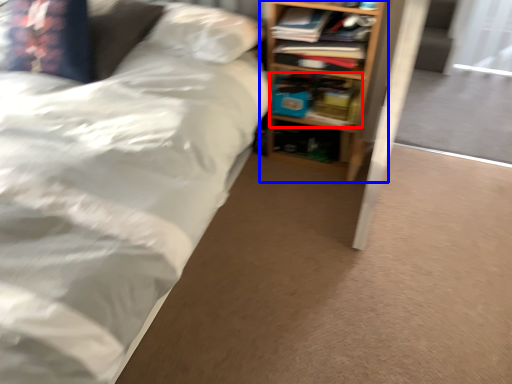
Question: Which object is further to the camera taking this photo, book (highlighted by a red box) or shelf (highlighted by a blue box)?

Choices:
 (A) book
 (B) shelf

Answer: (A)